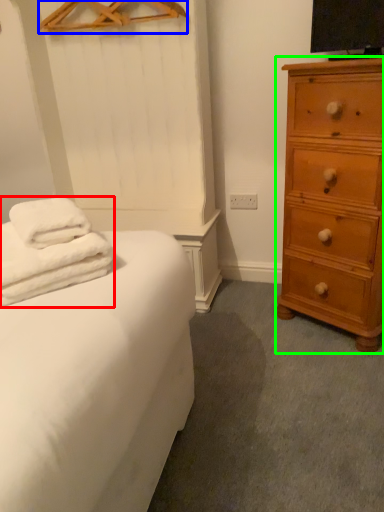
Question: Which object is positioned farthest from bath towel (highlighted by a red box)? Select from hanger (highlighted by a blue box) and chest of drawers (highlighted by a green box).

Choices:
 (A) hanger
 (B) chest of drawers

Answer: (A)